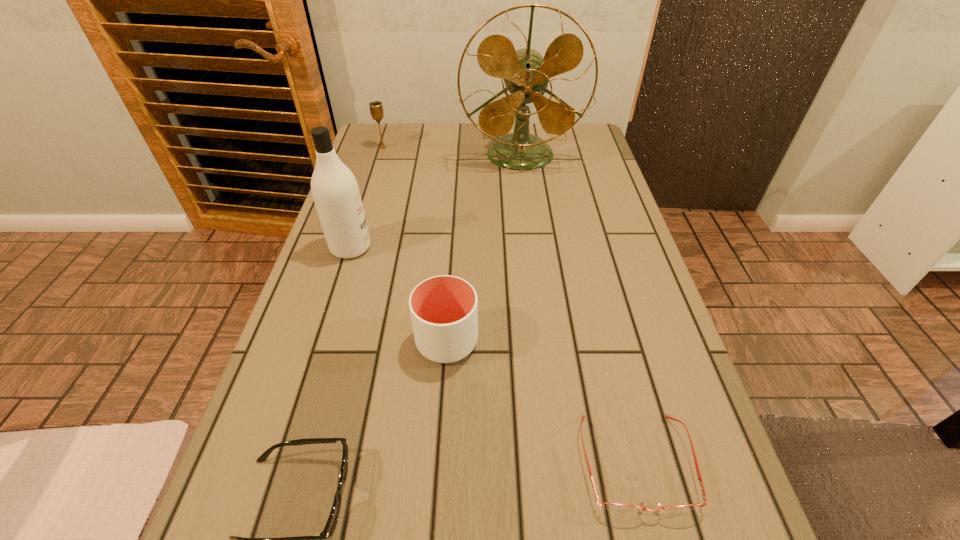
Identify the location of the tallest object. (526, 73).

Where is `the fourth nearest object`? the fourth nearest object is located at coordinates (336, 194).

Locate an element on the screen. shampoo is located at coordinates (336, 194).

Image resolution: width=960 pixels, height=540 pixels. Identify the location of the fourth shortest object. (376, 108).

Locate an element on the screen. Image resolution: width=960 pixels, height=540 pixels. the third shortest object is located at coordinates (444, 309).

At what (x,y) coordinates should I click in order to perform the action: click on cup. Please return your answer as a coordinate pair (x, y). The height and width of the screenshot is (540, 960). Looking at the image, I should click on (444, 309).

Where is `the shortest object`? the shortest object is located at coordinates (616, 507).

I want to click on the right spectacles, so click(x=616, y=507).

The height and width of the screenshot is (540, 960). Find the location of `vacant space located 0.170m in front of the fan, directing air flow`. vacant space located 0.170m in front of the fan, directing air flow is located at coordinates (527, 210).

Locate an element on the screen. vacant space located on the front-facing side of the shampoo is located at coordinates (532, 247).